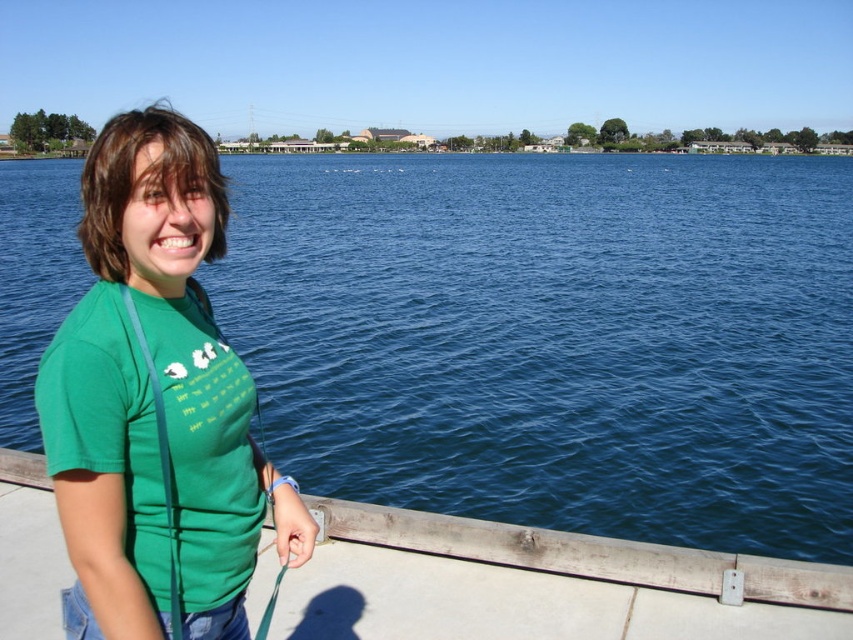
Question: Does green matte shirt at left have a smaller size compared to wooden at lower center?

Choices:
 (A) yes
 (B) no

Answer: (B)

Question: Which object is closer to the camera taking this photo?

Choices:
 (A) wooden at lower center
 (B) blue water at center

Answer: (A)

Question: Estimate the real-world distances between objects in this image. Which object is closer to the green matte shirt at left?

Choices:
 (A) blue water at center
 (B) wooden at lower center

Answer: (B)

Question: Is green matte shirt at left closer to camera compared to wooden at lower center?

Choices:
 (A) yes
 (B) no

Answer: (A)

Question: Which object is closer to the camera taking this photo?

Choices:
 (A) blue water at center
 (B) wooden at lower center
 (C) green matte shirt at left

Answer: (C)

Question: Can you confirm if green matte shirt at left is bigger than wooden at lower center?

Choices:
 (A) yes
 (B) no

Answer: (A)